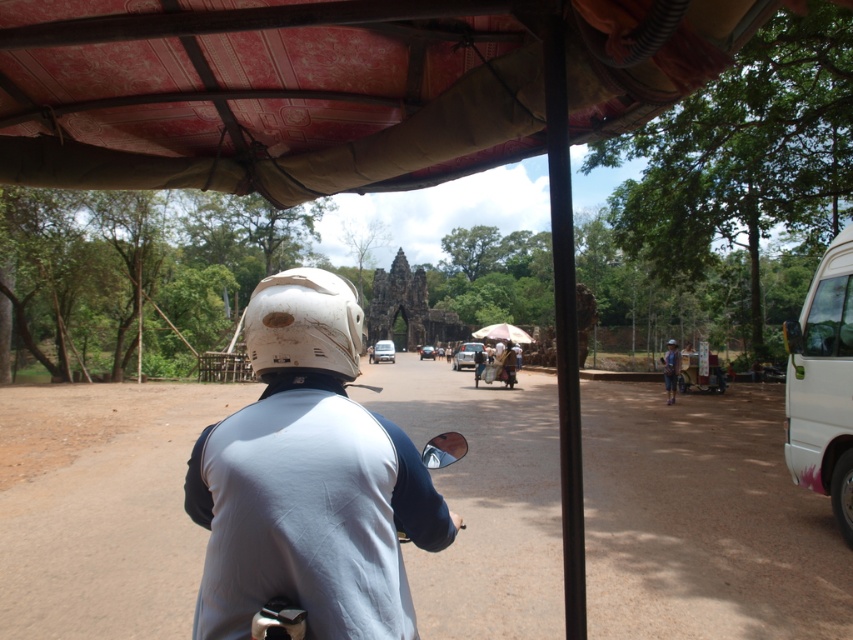
You are navigating a motorbike through a dusty road under a red and beige canopy. You notice two points marked on your GPS. The first point is at coordinate point (697,38) and the second is at point (798,353). According to the scene, which point is closer to your current position as the rider?

Point (697,38) is in front of point (798,353), so the point closer to your current position as the rider is point (697,38).